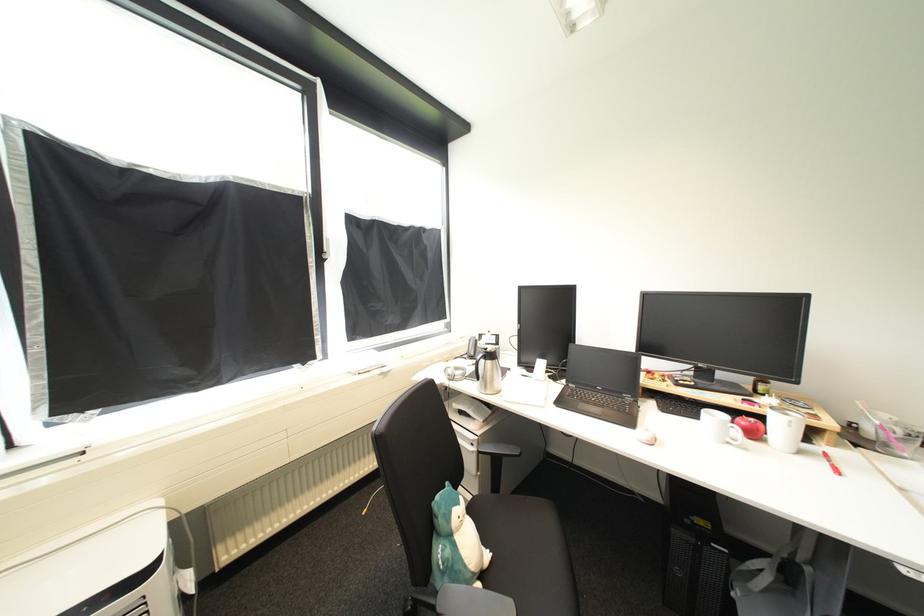
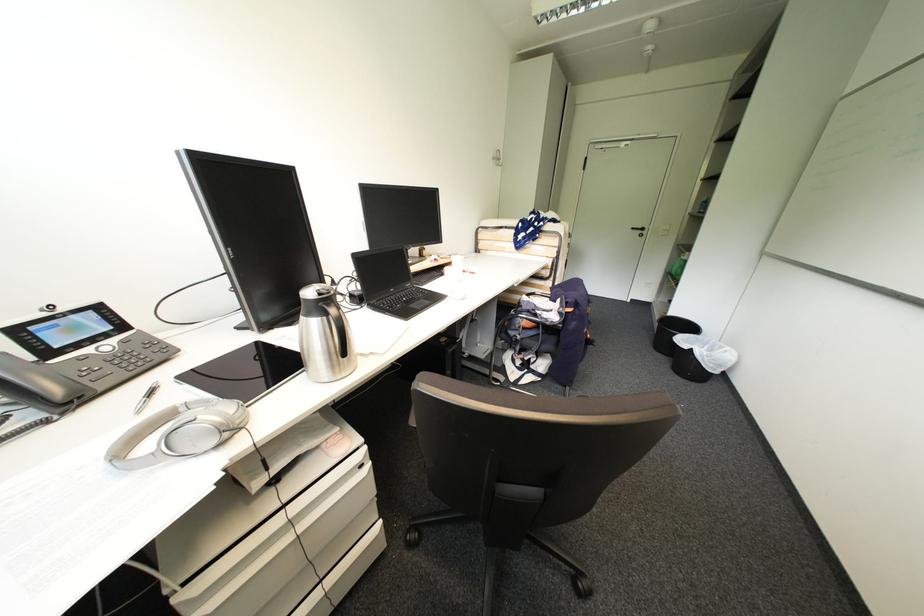
The point at [468,414] is marked in the first image. Where is the corresponding point in the second image?

(283, 480)